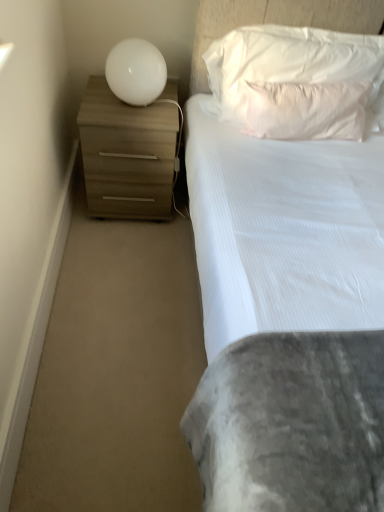
Question: Can you confirm if white soft pillow at upper center, placed as the 2th pillow when sorted from bottom to top, is positioned to the right of matte wood chest of drawers at left?

Choices:
 (A) no
 (B) yes

Answer: (B)

Question: Is white soft pillow at upper center, placed as the 2th pillow when sorted from bottom to top, smaller than matte wood chest of drawers at left?

Choices:
 (A) no
 (B) yes

Answer: (B)

Question: Is white soft pillow at upper center, the first pillow in the top-to-bottom sequence, placed right next to matte wood chest of drawers at left?

Choices:
 (A) yes
 (B) no

Answer: (B)

Question: Considering the relative sizes of white soft pillow at upper center, placed as the 2th pillow when sorted from bottom to top, and matte wood chest of drawers at left in the image provided, is white soft pillow at upper center, placed as the 2th pillow when sorted from bottom to top, taller than matte wood chest of drawers at left?

Choices:
 (A) yes
 (B) no

Answer: (B)

Question: Is matte wood chest of drawers at left inside white soft pillow at upper center, placed as the 2th pillow when sorted from bottom to top?

Choices:
 (A) no
 (B) yes

Answer: (A)

Question: Does white soft pillow at upper center, the first pillow in the top-to-bottom sequence, lie behind matte wood chest of drawers at left?

Choices:
 (A) yes
 (B) no

Answer: (B)

Question: From the image's perspective, does white glossy sphere at upper left appear higher than white soft pillow at upper center, the first pillow in the top-to-bottom sequence?

Choices:
 (A) no
 (B) yes

Answer: (A)

Question: Does white glossy sphere at upper left lie behind white soft pillow at upper center, the first pillow in the top-to-bottom sequence?

Choices:
 (A) no
 (B) yes

Answer: (B)

Question: Is white glossy sphere at upper left with white soft pillow at upper center, the first pillow in the top-to-bottom sequence?

Choices:
 (A) no
 (B) yes

Answer: (A)

Question: Can you confirm if white glossy sphere at upper left is taller than white soft pillow at upper center, the first pillow in the top-to-bottom sequence?

Choices:
 (A) no
 (B) yes

Answer: (A)

Question: Does white glossy sphere at upper left have a smaller size compared to white soft pillow at upper center, placed as the 2th pillow when sorted from bottom to top?

Choices:
 (A) no
 (B) yes

Answer: (B)

Question: Is white glossy sphere at upper left oriented away from white soft pillow at upper center, placed as the 2th pillow when sorted from bottom to top?

Choices:
 (A) no
 (B) yes

Answer: (A)

Question: Does matte wood chest of drawers at left have a larger size compared to white soft pillow at upper center, placed as the 2th pillow when sorted from bottom to top?

Choices:
 (A) no
 (B) yes

Answer: (B)